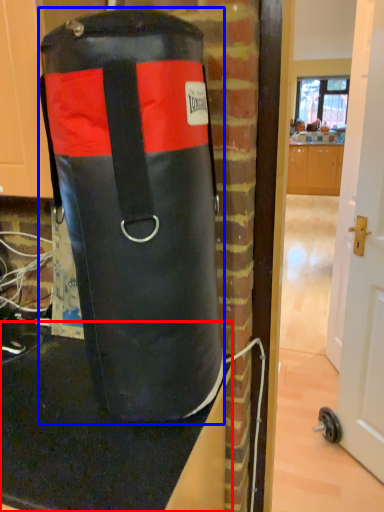
Question: Which object is closer to the camera taking this photo, table top (highlighted by a red box) or punching bag (highlighted by a blue box)?

Choices:
 (A) table top
 (B) punching bag

Answer: (B)